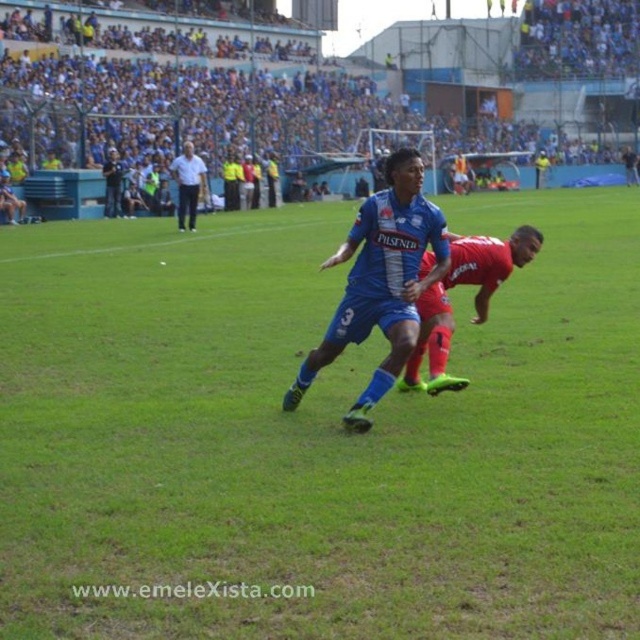
You are a soccer player positioned at the point marked as point (92, 456) on the field. You need to pass the ball to your teammate who is standing exactly 15 meters away from you. Is the distance between you and your teammate sufficient to make a direct pass without needing to adjust your position?

The distance between point (92, 456) and the viewer is 12.61 meters. Since your teammate is 15 meters away, which is farther than 12.61 meters, you would need to adjust your position to ensure the pass reaches them directly.

From the picture: You are a photographer standing at the edge of the soccer field. You want to take a photo of the blue fabric soccer player at center. If your camera has a maximum focus range of 10 meters, will you be able to capture the player clearly?

The blue fabric soccer player at center is 8.58 meters away from the viewer. Since the camera can focus up to 10 meters, it is within the range, so yes, the photographer can capture the player clearly.

In the scene shown: You are a photographer at the soccer match and want to capture a photo of both the blue jersey at center and the white cotton shirt at upper center in the same frame. Based on their positions, which direction should you move your camera to include both?

You should move your camera to the left to include both the blue jersey at center and the white cotton shirt at upper center since the blue jersey at center is to the right of the white cotton shirt at upper center.